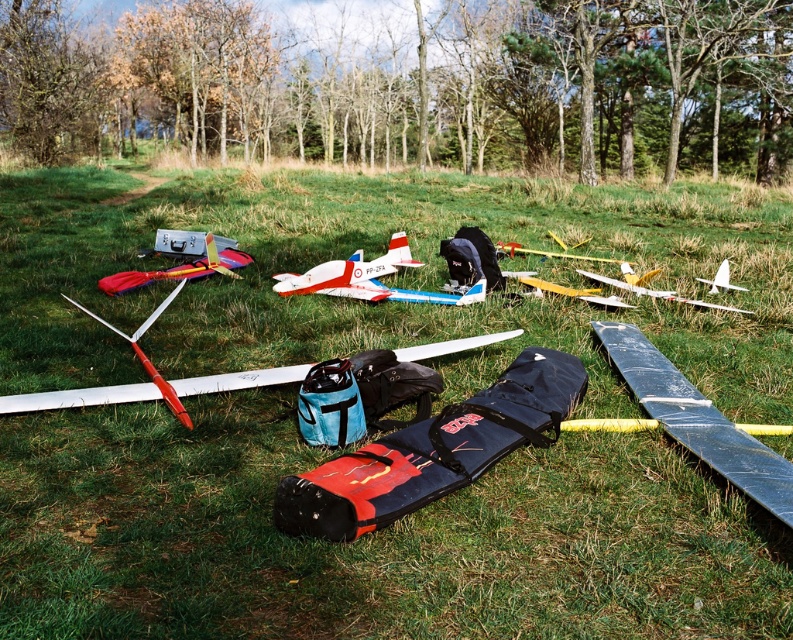
Between shiny metallic wing at lower right and blue fabric bag at center, which one has less height?

With less height is blue fabric bag at center.

Between point (652, 400) and point (309, 380), which one is positioned in front?

Point (309, 380) is in front.

Locate an element on the screen. shiny metallic wing at lower right is located at coordinates (696, 419).

Can you confirm if black matte bag at center is bigger than yellow matte airplane at center?

Indeed, black matte bag at center has a larger size compared to yellow matte airplane at center.

Does black matte bag at center appear over yellow matte airplane at center?

No, black matte bag at center is not above yellow matte airplane at center.

Is point (435, 444) positioned in front of point (615, 307)?

Yes, it is.

Locate an element on the screen. The width and height of the screenshot is (793, 640). black matte bag at center is located at coordinates (433, 451).

Which of these two, matte white airplane at center or matte black airplane at center, stands taller?

matte black airplane at center is taller.

Consider the image. Which is more to the right, matte white airplane at center or matte black airplane at center?

From the viewer's perspective, matte white airplane at center appears more on the right side.

Which is behind, point (63, 406) or point (190, 248)?

The point (190, 248) is behind.

Identify the location of matte white airplane at center. (81, 396).